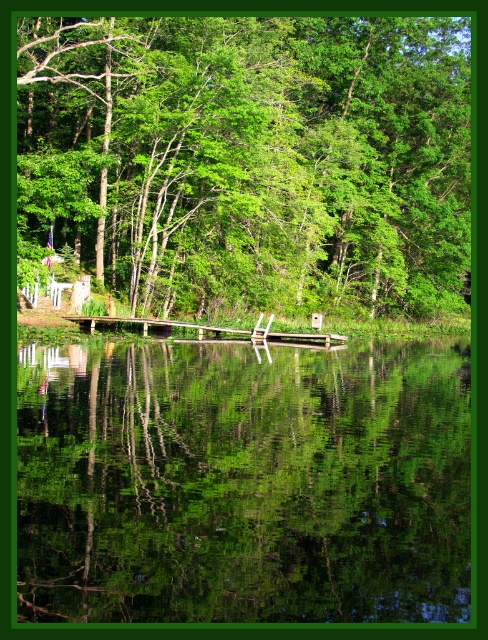
Question: Does green leafy tree at upper center lie in front of green reflective water at center?

Choices:
 (A) yes
 (B) no

Answer: (B)

Question: Does green leafy tree at upper center have a lesser width compared to green reflective water at center?

Choices:
 (A) yes
 (B) no

Answer: (B)

Question: Does green leafy tree at upper center have a larger size compared to green reflective water at center?

Choices:
 (A) no
 (B) yes

Answer: (B)

Question: Which point is closer to the camera?

Choices:
 (A) (80, 161)
 (B) (66, 378)

Answer: (B)